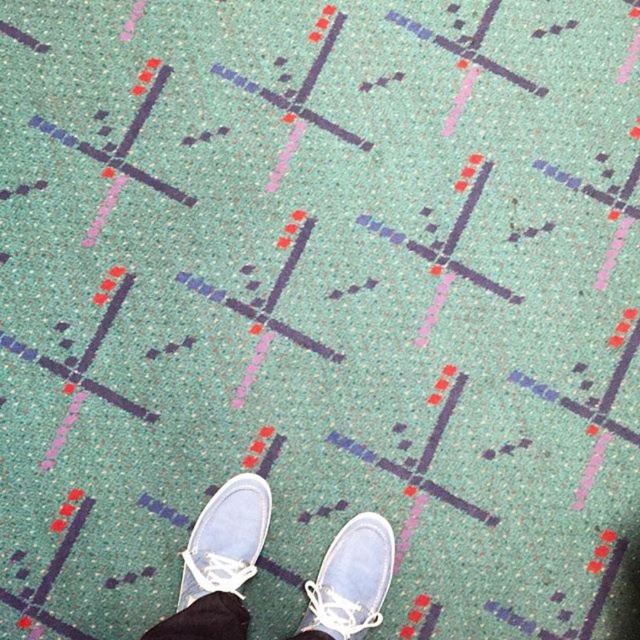
Consider the image. You are standing on the patterned carpet floor and see two white canvas shoes at center and a white canvas shoe at center. Which one is closer to you?

The white canvas shoes at center is closer to the viewer than the white canvas shoe at center.

You are standing on the carpet and see the white canvas shoes at center and the white suede shoe at lower center. Which pair of shoes is closer to the top of the image?

The white canvas shoes at center is taller than the white suede shoe at lower center, so the white canvas shoes at center is closer to the top of the image.